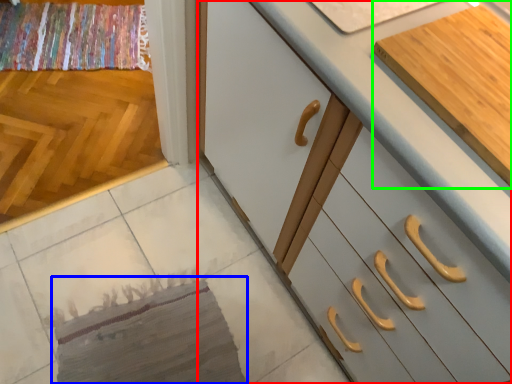
Question: Which is nearer to the cabinetry (highlighted by a red box)? mat (highlighted by a blue box) or cabinetry (highlighted by a green box).

Choices:
 (A) mat
 (B) cabinetry

Answer: (B)